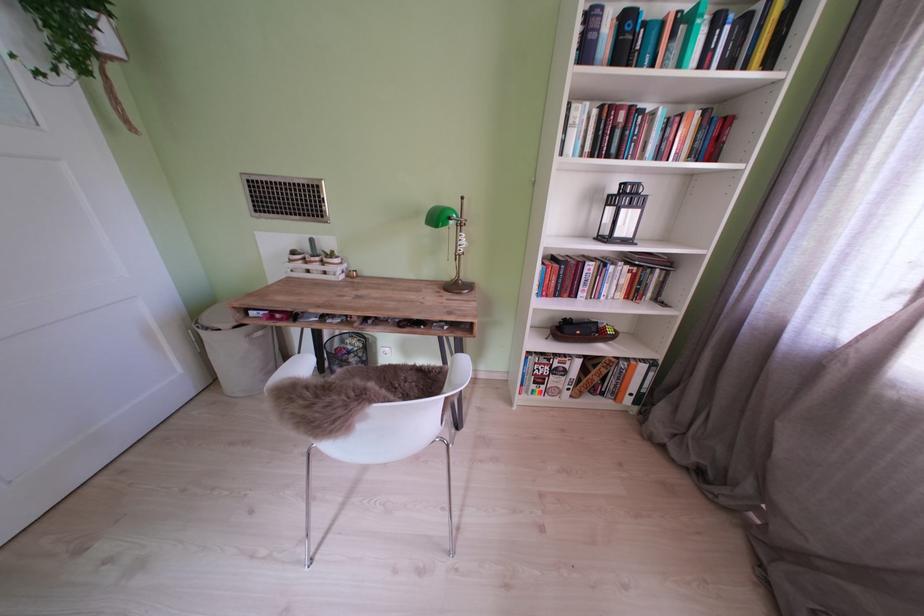
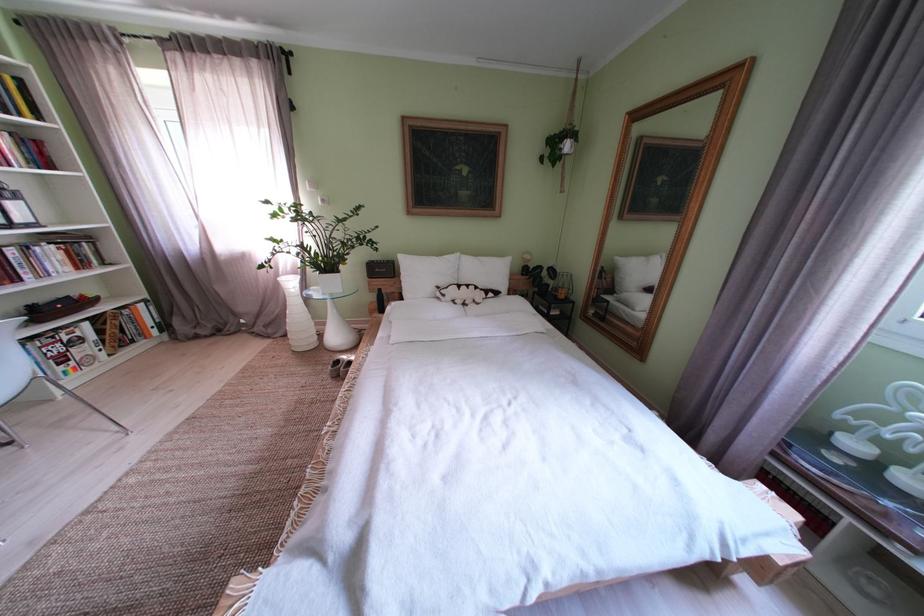
The point at [622,274] is marked in the first image. Where is the corresponding point in the second image?

(49, 254)